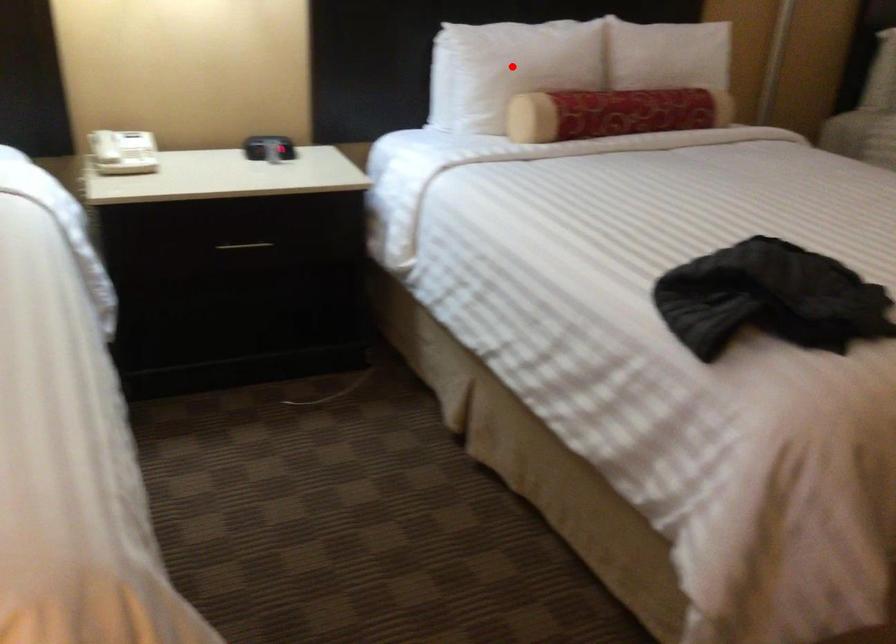
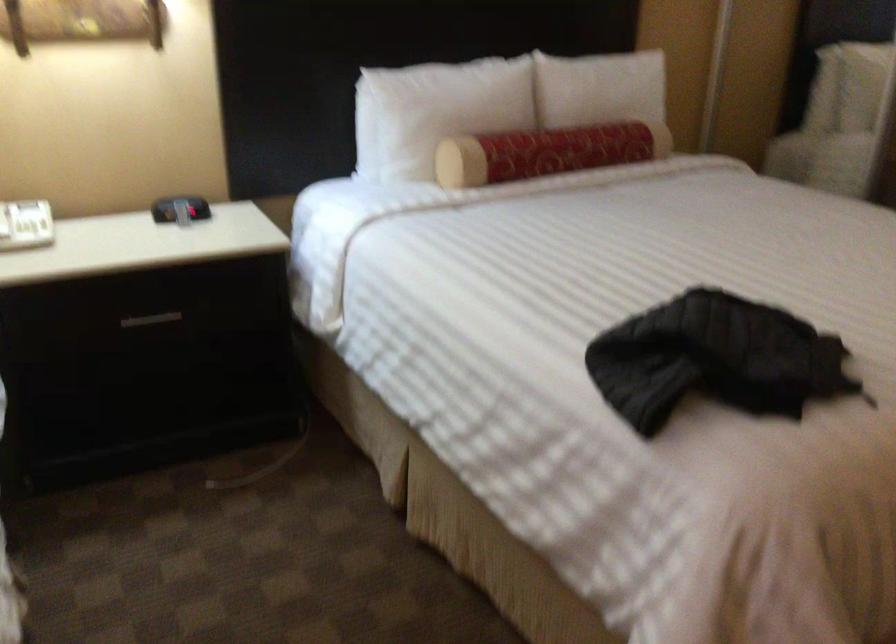
The point at the highlighted location is marked in the first image. Where is the corresponding point in the second image?

(435, 111)